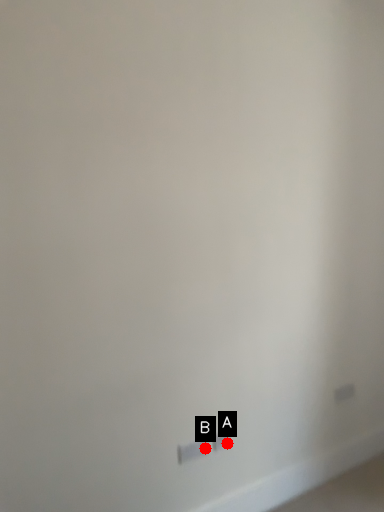
Question: Two points are circled on the image, labeled by A and B beside each circle. Which point is closer to the camera?

Choices:
 (A) A is closer
 (B) B is closer

Answer: (B)